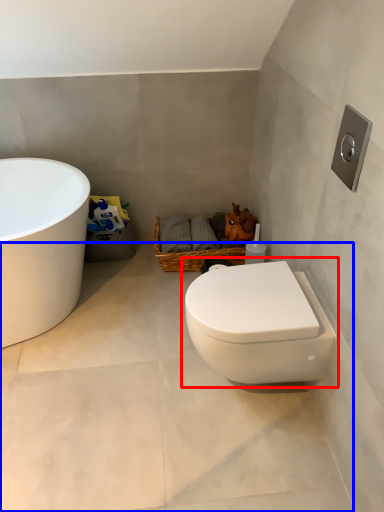
Question: Among these objects, which one is farthest to the camera, toilet (highlighted by a red box) or concrete (highlighted by a blue box)?

Choices:
 (A) toilet
 (B) concrete

Answer: (A)